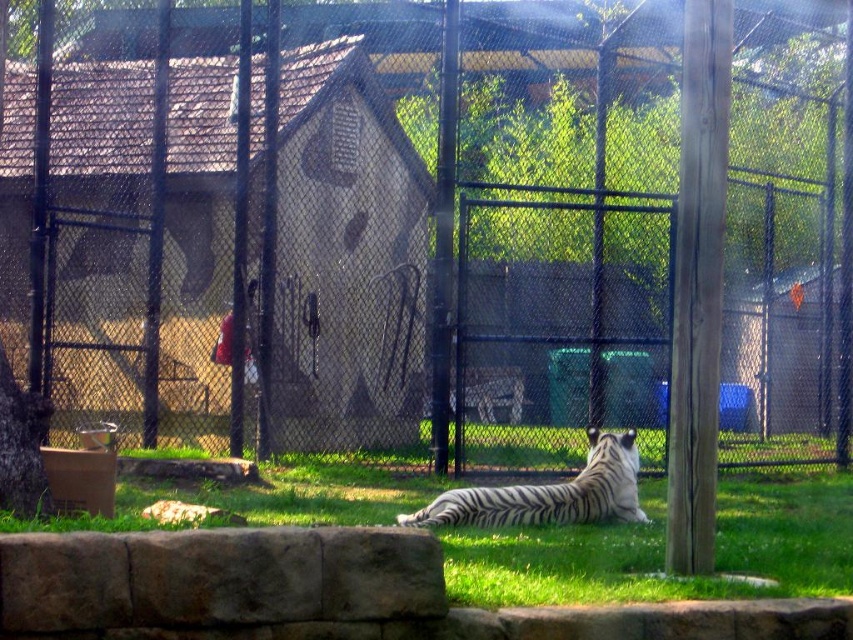
Question: Which object is farther from the camera taking this photo?

Choices:
 (A) green grass at center
 (B) white striped tiger at center

Answer: (B)

Question: Is metal mesh fence at center closer to camera compared to green grass at center?

Choices:
 (A) no
 (B) yes

Answer: (A)

Question: Which of the following is the farthest from the observer?

Choices:
 (A) (566, 493)
 (B) (587, 339)

Answer: (B)

Question: Which of the following is the farthest from the observer?

Choices:
 (A) green grass at center
 (B) white striped tiger at center

Answer: (B)

Question: Is green grass at center thinner than white striped tiger at center?

Choices:
 (A) no
 (B) yes

Answer: (B)

Question: Does metal mesh fence at center appear on the left side of white striped tiger at center?

Choices:
 (A) yes
 (B) no

Answer: (A)